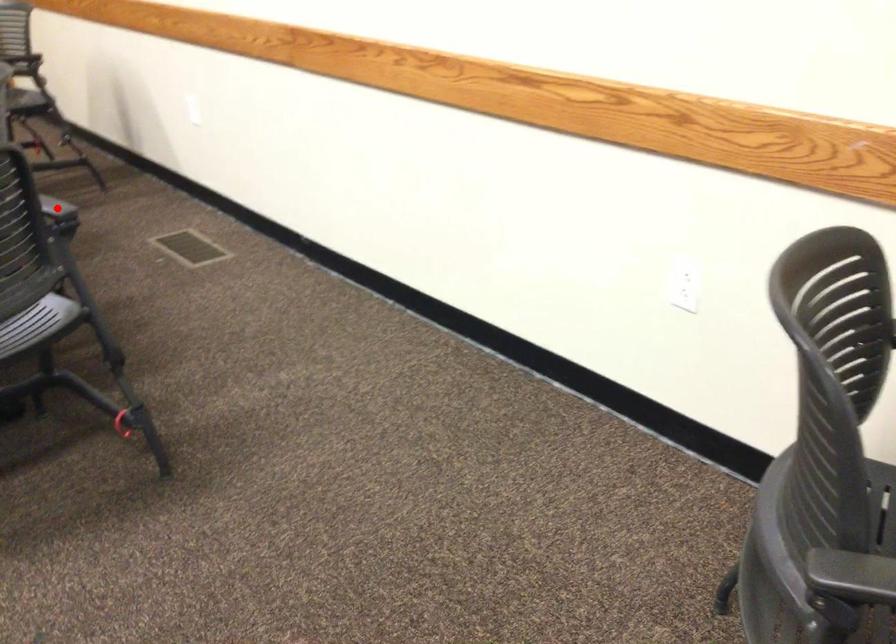
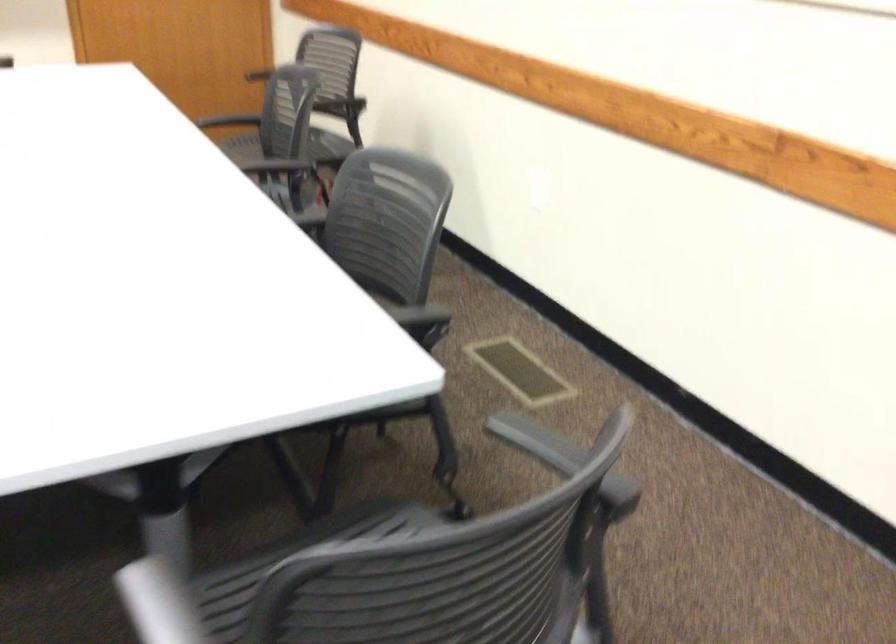
Question: I am providing you with two images of the same scene from different viewpoints. A red point is marked on the first image. Is the red point's position out of view in image 2?

Choices:
 (A) Yes
 (B) No

Answer: (A)